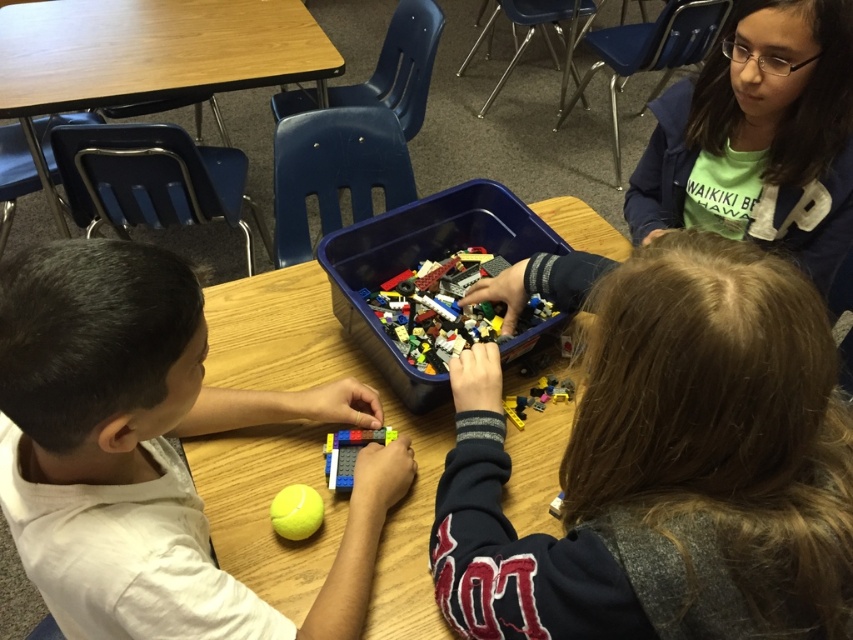
Can you confirm if translucent plastic lego at lower center is bigger than translucent plastic lego at center?

No.

How distant is translucent plastic lego at lower center from translucent plastic lego at center?

translucent plastic lego at lower center and translucent plastic lego at center are 10.76 inches apart.

Between point (334, 468) and point (523, 404), which one is positioned in front?

Point (334, 468)

I want to click on translucent plastic lego at lower center, so click(349, 452).

Is point (651, 552) positioned in front of point (300, 464)?

Yes, point (651, 552) is closer to viewer.

Between dark brown hair at center and wooden table at center, which one appears on the left side from the viewer's perspective?

wooden table at center

Who is more distant from viewer, (x=784, y=417) or (x=526, y=422)?

The point (x=526, y=422) is more distant.

I want to click on dark brown hair at center, so click(663, 460).

Does wooden table at upper left have a greater height compared to yellow rubber tennis ball at lower center?

Yes, wooden table at upper left is taller than yellow rubber tennis ball at lower center.

Is wooden table at upper left closer to the viewer compared to yellow rubber tennis ball at lower center?

No.

The image size is (853, 640). What do you see at coordinates (149, 54) in the screenshot?
I see `wooden table at upper left` at bounding box center [149, 54].

Locate an element on the screen. wooden table at upper left is located at coordinates (149, 54).